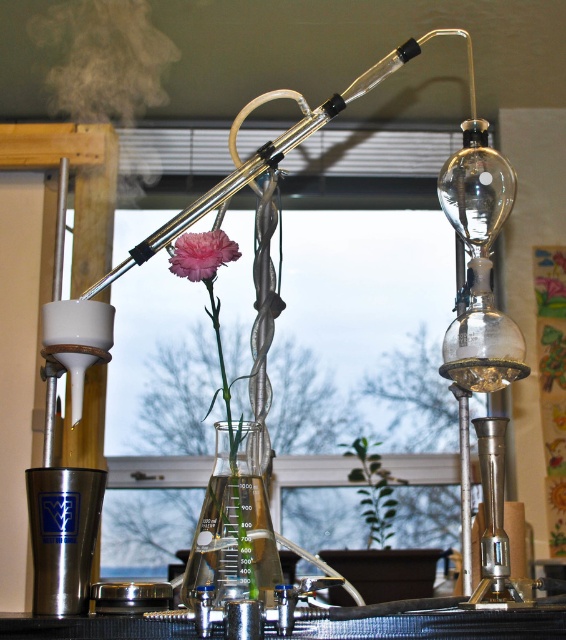
Question: Which point is farther from the camera taking this photo?

Choices:
 (A) (220, 509)
 (B) (211, 259)

Answer: (A)

Question: Can you confirm if transparent glass beaker at center is positioned above pink matte flower at center?

Choices:
 (A) no
 (B) yes

Answer: (A)

Question: Can you confirm if transparent glass beaker at center is positioned to the right of pink matte flower at center?

Choices:
 (A) no
 (B) yes

Answer: (B)

Question: Among these objects, which one is farthest from the camera?

Choices:
 (A) pink matte flower at center
 (B) transparent glass beaker at center

Answer: (A)

Question: Does transparent glass beaker at center appear over pink matte flower at center?

Choices:
 (A) no
 (B) yes

Answer: (A)